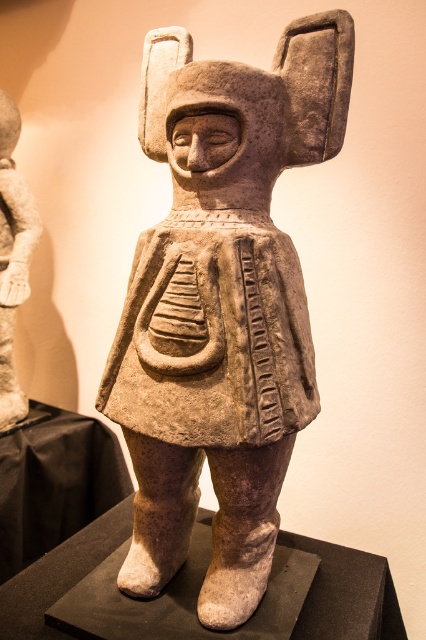
Identify the location of stone statue at center. (221, 305).

The width and height of the screenshot is (426, 640). Describe the element at coordinates (221, 305) in the screenshot. I see `stone statue at center` at that location.

Is point (322, 124) positioned in front of point (34, 230)?

That is True.

At what (x,y) coordinates should I click in order to perform the action: click on stone statue at center. Please return your answer as a coordinate pair (x, y). This screenshot has width=426, height=640. Looking at the image, I should click on (221, 305).